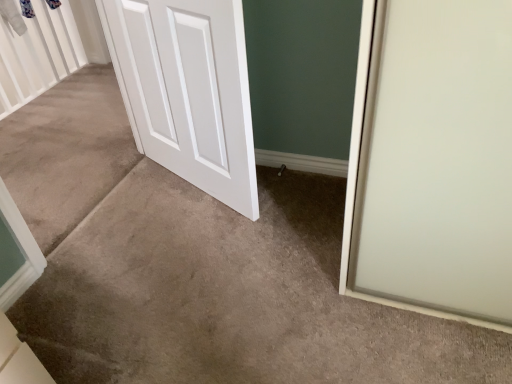
This screenshot has width=512, height=384. Identify the location of white glossy door at upper left. (190, 91).

Describe the element at coordinates (190, 91) in the screenshot. I see `white glossy door at upper left` at that location.

Where is `white glossy door at upper left`? white glossy door at upper left is located at coordinates (190, 91).